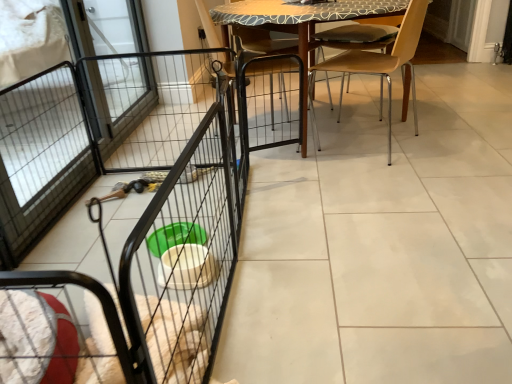
I want to click on black wire screen door at left, so click(x=104, y=27).

The image size is (512, 384). What do you see at coordinates (302, 60) in the screenshot?
I see `wooden chair at center` at bounding box center [302, 60].

Identify the location of wooden chair at center. Image resolution: width=512 pixels, height=384 pixels. (302, 60).

Find the location of a particular element. The image size is (512, 384). light brown wood chair at center is located at coordinates (381, 62).

Where is `wooden table at center`? wooden table at center is located at coordinates (302, 19).

Who is more distant, wooden chair at center or black wire screen door at left?

Positioned behind is black wire screen door at left.

At what (x,y) coordinates should I click in order to perform the action: click on screen door above the wooden chair at center (from a real-world perspective). Please return your answer as a coordinate pair (x, y). This screenshot has width=512, height=384. Looking at the image, I should click on (104, 27).

Based on the photo, is wooden chair at center in contact with black wire screen door at left?

No.

Does point (303, 133) lie behind point (72, 19)?

No, it is not.

Who is shorter, black wire cage at center or light brown wood chair at center?

Standing shorter between the two is black wire cage at center.

At what (x,y) coordinates should I click in order to perform the action: click on cage below the light brown wood chair at center (from the image's perspective). Please return your answer as a coordinate pair (x, y). The image size is (512, 384). Looking at the image, I should click on (163, 263).

Considering the relative sizes of black wire cage at center and light brown wood chair at center in the image provided, is black wire cage at center smaller than light brown wood chair at center?

Actually, black wire cage at center might be larger than light brown wood chair at center.

Which of these two, black wire cage at center or light brown wood chair at center, is thinner?

light brown wood chair at center.

From the image's perspective, is wooden table at center above or below black wire cage at center?

Clearly, from the image's perspective, wooden table at center is above black wire cage at center.

Is wooden table at center looking in the opposite direction of black wire cage at center?

That's not correct — wooden table at center is not looking away from black wire cage at center.

Consider the image. Is wooden table at center positioned beyond the bounds of black wire cage at center?

That's correct, wooden table at center is outside of black wire cage at center.

Is point (406, 3) closer or farther from the camera than point (163, 376)?

Clearly, point (406, 3) is more distant from the camera than point (163, 376).

Is wooden chair at center behind light brown wood chair at center?

Yes, it is.

From a real-world perspective, is wooden chair at center positioned above or below light brown wood chair at center?

wooden chair at center is situated higher than light brown wood chair at center in the real world.

Considering the sizes of wooden chair at center and light brown wood chair at center in the image, is wooden chair at center taller or shorter than light brown wood chair at center?

In the image, wooden chair at center appears to be taller than light brown wood chair at center.

Looking at this image, can you confirm if wooden table at center is bigger than black wire screen door at left?

Correct, wooden table at center is larger in size than black wire screen door at left.

Is there a large distance between wooden table at center and black wire screen door at left?

Yes, wooden table at center and black wire screen door at left are quite far apart.

Between wooden table at center and black wire screen door at left, which one has more height?

black wire screen door at left is taller.

Is point (321, 10) farther from camera compared to point (122, 45)?

No.

Does black wire cage at center turn towards black wire screen door at left?

No, black wire cage at center is not turned towards black wire screen door at left.

From a real-world perspective, which object rests below the other?

From a 3D spatial view, black wire cage at center is below.

Is black wire cage at center positioned beyond the bounds of black wire screen door at left?

Yes, black wire cage at center is outside of black wire screen door at left.

Can you tell me how much black wire cage at center and black wire screen door at left differ in facing direction?

3.14 degrees separate the facing orientations of black wire cage at center and black wire screen door at left.

Visually, is black wire screen door at left positioned to the left or to the right of light brown wood chair at center?

Clearly, black wire screen door at left is on the left of light brown wood chair at center in the image.

From the picture: Can you confirm if black wire screen door at left is thinner than light brown wood chair at center?

Yes.

The image size is (512, 384). I want to click on screen door above the light brown wood chair at center (from the image's perspective), so click(104, 27).

The image size is (512, 384). I want to click on armchair on the right of black wire screen door at left, so click(302, 60).

Where is `chair behind the black wire cage at center`? chair behind the black wire cage at center is located at coordinates (381, 62).

Which object lies further to the anchor point wooden chair at center, light brown wood chair at center or black wire screen door at left?

black wire screen door at left.

When comparing their distances from light brown wood chair at center, does black wire cage at center or wooden chair at center seem closer?

The object closer to light brown wood chair at center is wooden chair at center.

Considering their positions, is wooden table at center positioned closer to black wire screen door at left than black wire cage at center?

wooden table at center is positioned closer to the anchor black wire screen door at left.

Based on their spatial positions, is wooden chair at center or light brown wood chair at center closer to black wire screen door at left?

The object closer to black wire screen door at left is wooden chair at center.

Considering their positions, is wooden chair at center positioned closer to black wire cage at center than wooden table at center?

The object closer to black wire cage at center is wooden chair at center.

Based on their spatial positions, is light brown wood chair at center or black wire cage at center further from black wire screen door at left?

light brown wood chair at center is positioned further to the anchor black wire screen door at left.

Based on their spatial positions, is black wire cage at center or wooden table at center closer to black wire screen door at left?

wooden table at center lies closer to black wire screen door at left than the other object.

Considering their positions, is wooden chair at center positioned closer to wooden table at center than light brown wood chair at center?

wooden chair at center is closer to wooden table at center.

At what (x,y) coordinates should I click in order to perform the action: click on armchair between black wire screen door at left and light brown wood chair at center in the horizontal direction. Please return your answer as a coordinate pair (x, y). The width and height of the screenshot is (512, 384). Looking at the image, I should click on (302, 60).

Image resolution: width=512 pixels, height=384 pixels. In order to click on table situated between wooden chair at center and light brown wood chair at center from left to right in this screenshot , I will do `click(302, 19)`.

Locate an element on the screen. table located between black wire screen door at left and light brown wood chair at center in the left-right direction is located at coordinates (302, 19).

Identify the location of armchair between black wire screen door at left and wooden table at center in the horizontal direction. Image resolution: width=512 pixels, height=384 pixels. (302, 60).